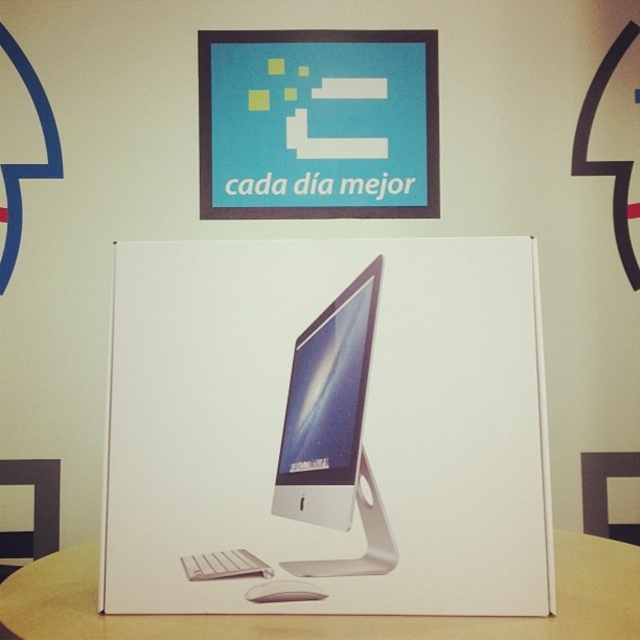
You are setting up a desk and want to place a 3.5 inch wide mouse between the white glossy desktop computer at center and the satin silver monitor at center. Can the mouse fit in the space between them?

The distance between the white glossy desktop computer at center and the satin silver monitor at center is 2.95 inches, which is less than the mouse width of 3.5 inches. Therefore, the mouse cannot fit in the space between them.

You are setting up a home office and want to place a new keyboard between the white glossy desktop computer at center and the satin silver monitor at center. Based on the scene description, which side of the monitor should you place the keyboard to align with the existing setup?

The white glossy desktop computer at center is to the left of the satin silver monitor at center, so you should place the keyboard to the left side of the monitor to align with the existing setup.